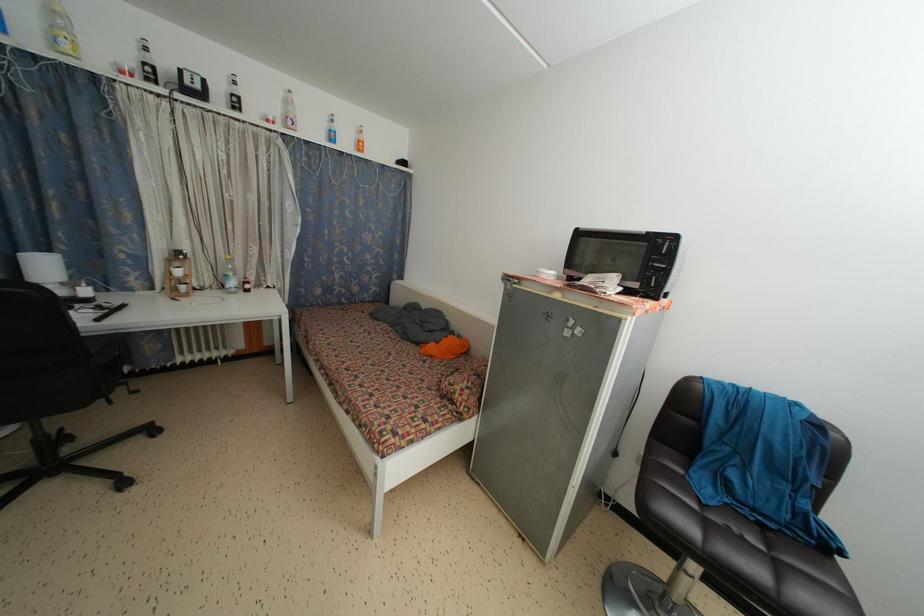
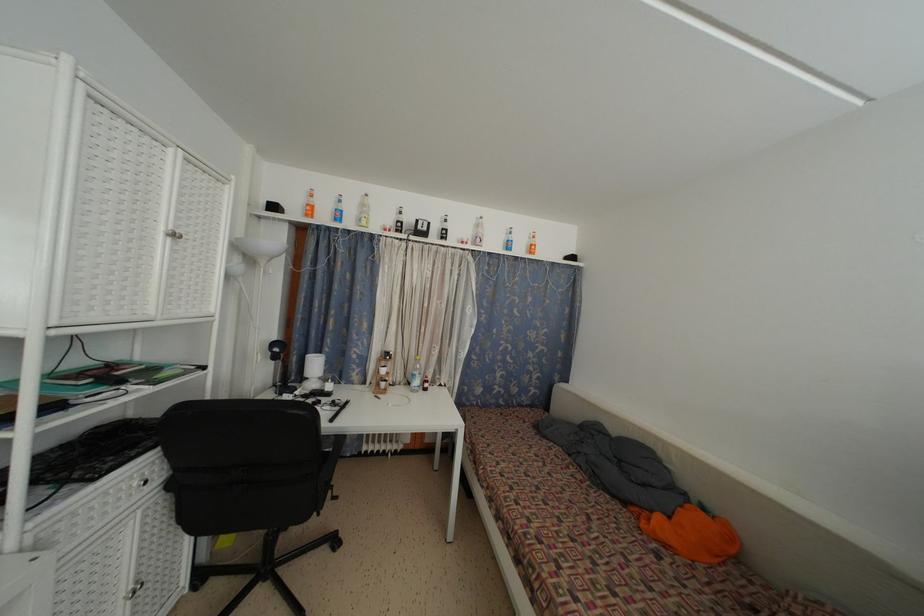
Find the pixel in the second image that matches (127,394) in the first image.

(333, 498)